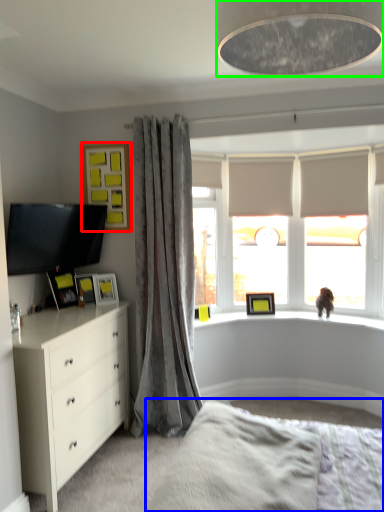
Question: Considering the real-world distances, which object is closest to picture frame (highlighted by a red box)? bed frame (highlighted by a blue box) or light fixture (highlighted by a green box).

Choices:
 (A) bed frame
 (B) light fixture

Answer: (A)